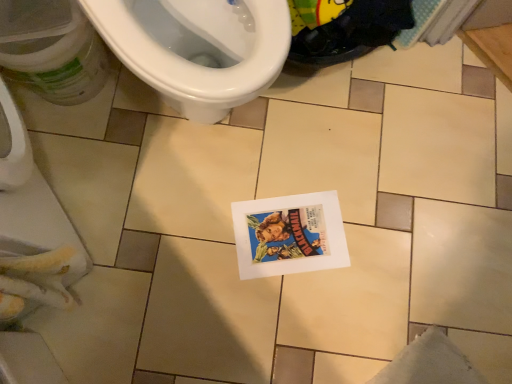
At what (x,y) coordinates should I click in order to perform the action: click on vacant space in between white glossy toilet at upper left and white paper comic book at center. Please return your answer as a coordinate pair (x, y). The width and height of the screenshot is (512, 384). Looking at the image, I should click on (247, 173).